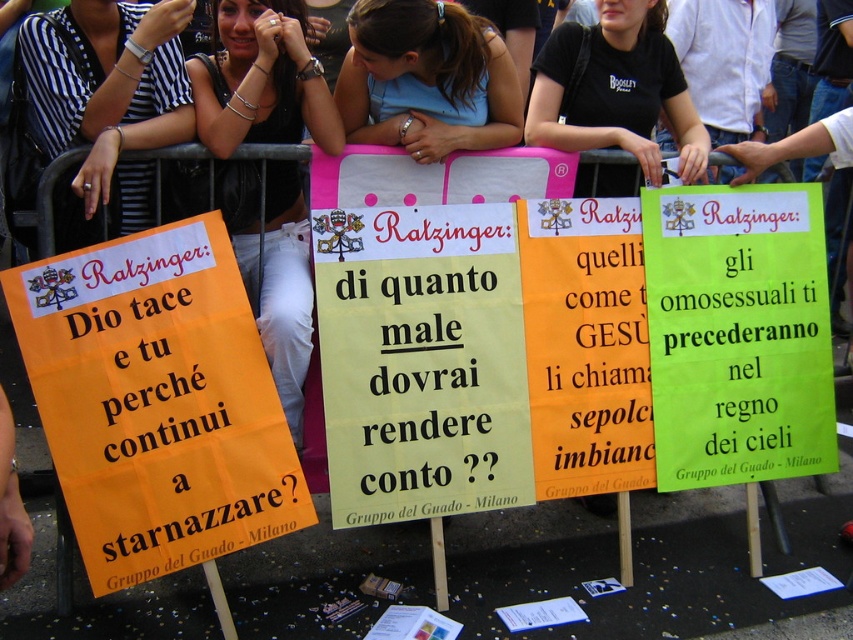
Question: Which of the following is the farthest from the observer?

Choices:
 (A) orange paper sign at center
 (B) black t-shirt at center
 (C) blue fabric shirt at center

Answer: (B)

Question: From the image, what is the correct spatial relationship of orange paper sign at left in relation to green paper sign at center?

Choices:
 (A) left
 (B) right

Answer: (A)

Question: Is orange paper sign at left thinner than black t-shirt at center?

Choices:
 (A) no
 (B) yes

Answer: (A)

Question: Can you confirm if black striped shirt at upper left is positioned to the left of blue fabric shirt at center?

Choices:
 (A) yes
 (B) no

Answer: (A)

Question: Among these objects, which one is nearest to the camera?

Choices:
 (A) green paper sign at center
 (B) orange paper sign at left

Answer: (B)

Question: Which point is farther to the camera?

Choices:
 (A) black striped shirt at upper left
 (B) green paper sign at center
 (C) yellow paper sign at center
 (D) orange paper sign at center

Answer: (B)